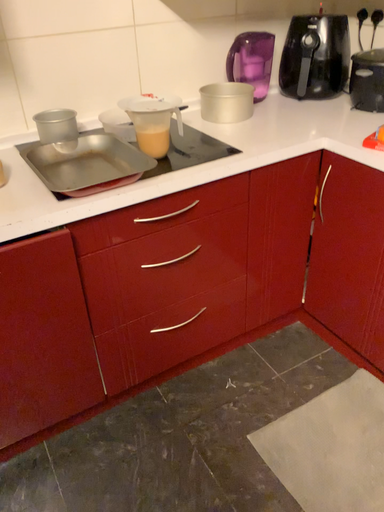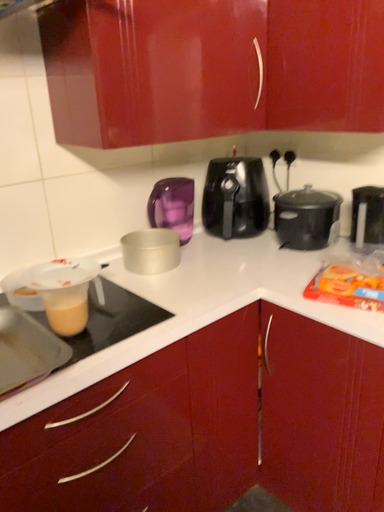
Question: Which way did the camera rotate in the video?

Choices:
 (A) rotated left
 (B) rotated right

Answer: (B)